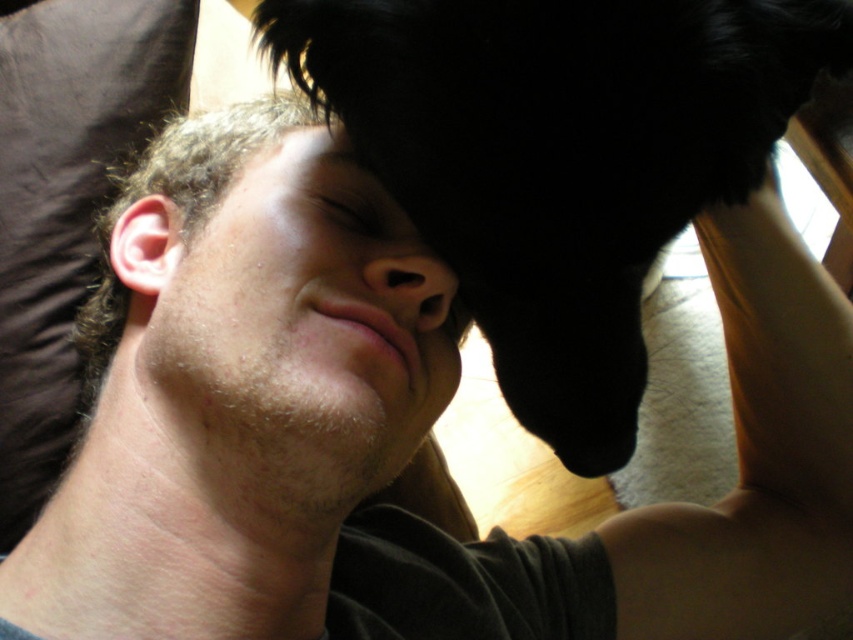
Question: Which point is closer to the camera?

Choices:
 (A) (405, 321)
 (B) (225, 132)

Answer: (A)

Question: Among these points, which one is farthest from the camera?

Choices:
 (A) (560, 269)
 (B) (453, 291)
 (C) (438, 460)

Answer: (C)

Question: Where is smooth skin head at center located in relation to matte skin nose at center in the image?

Choices:
 (A) above
 (B) below

Answer: (B)

Question: Which object is farther from the camera taking this photo?

Choices:
 (A) black fur at upper center
 (B) matte skin nose at center
 (C) smooth skin head at center

Answer: (B)

Question: Where is black fur at upper center located in relation to smooth skin head at center in the image?

Choices:
 (A) left
 (B) right

Answer: (B)

Question: Is black fur at upper center further to the viewer compared to smooth skin head at center?

Choices:
 (A) yes
 (B) no

Answer: (B)